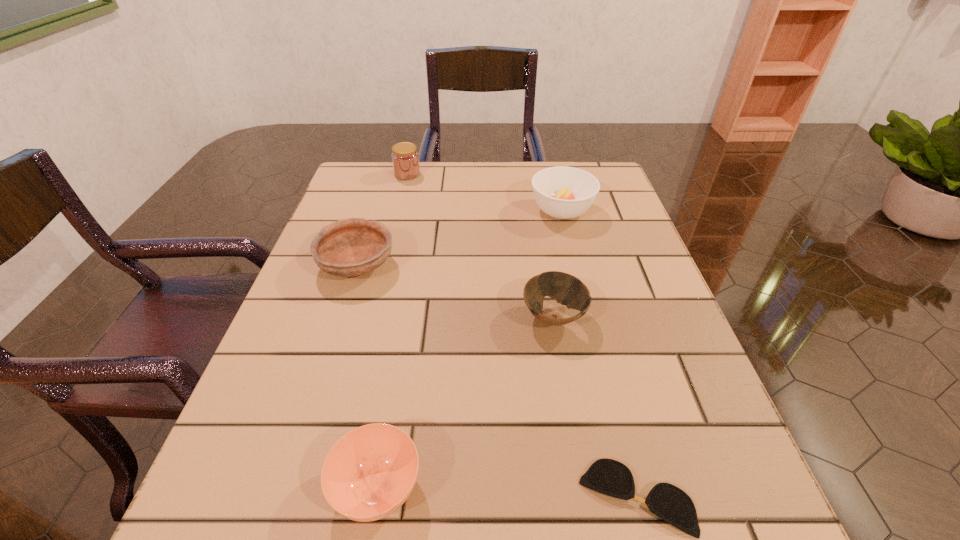
Image resolution: width=960 pixels, height=540 pixels. Find the location of `free space located on the right of the jam`. free space located on the right of the jam is located at coordinates (502, 174).

I want to click on vacant region located 0.390m on the front of the farther soup bowl, so click(x=599, y=363).

Find the location of a particular element. vacant space located on the front of the left bowl is located at coordinates (323, 374).

This screenshot has height=540, width=960. Identify the location of vacant area situated 0.380m on the left of the right bowl. pyautogui.click(x=321, y=317).

At what (x,y) coordinates should I click in order to perform the action: click on free region located on the left of the nearer soup bowl. Please return your answer as a coordinate pair (x, y). The image size is (960, 540). Looking at the image, I should click on (215, 488).

At what (x,y) coordinates should I click in order to perform the action: click on free spot located 0.370m on the left of the shortest object. Please return your answer as a coordinate pair (x, y). The height and width of the screenshot is (540, 960). Looking at the image, I should click on pos(305,497).

Find the location of a particular element. This screenshot has height=540, width=960. jam at the far edge is located at coordinates (405, 158).

Identify the location of soup bowl present at the far edge. (562, 192).

You are a GUI agent. You are given a task and a screenshot of the screen. Output one action in this format:
    pyautogui.click(x=<x>, y=<y>)
    Task: Click on the soup bowl at the near edge
    
    Given the screenshot: What is the action you would take?
    (x=369, y=473)

Locate an element on the screen. The width and height of the screenshot is (960, 540). spectacles located at the near edge is located at coordinates (610, 477).